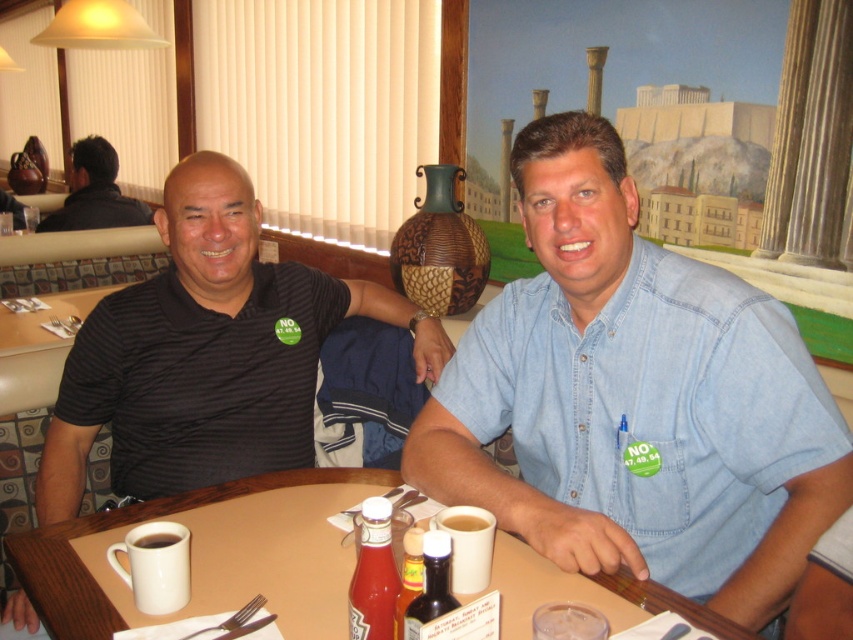
You are a photographer taking a picture of the black shirt at upper left and the brown ceramic mug at center. Which object should you focus on first if you want to ensure both are in sharp focus?

The black shirt at upper left is much taller than the brown ceramic mug at center, so you should focus on the black shirt at upper left first to ensure both are in sharp focus.